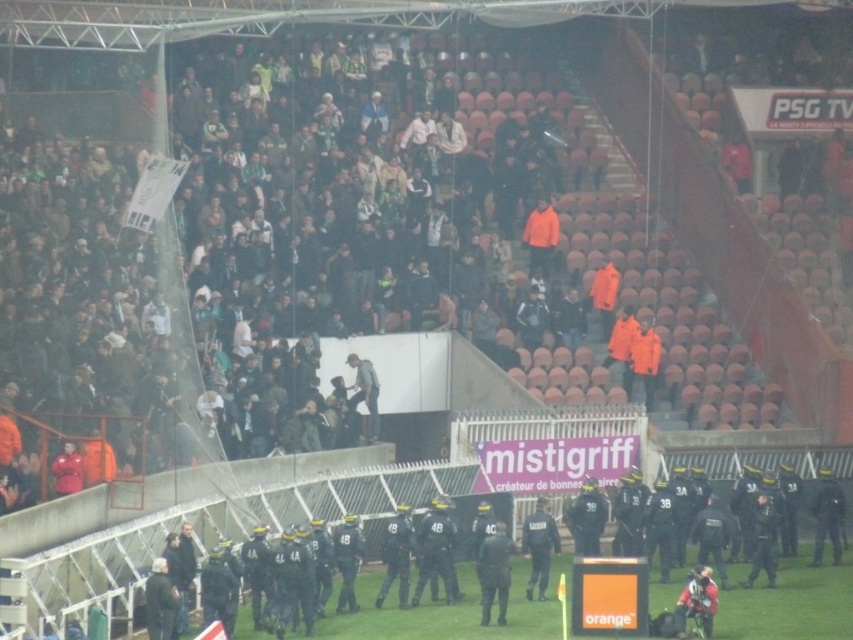
The width and height of the screenshot is (853, 640). What do you see at coordinates (434, 550) in the screenshot?
I see `black matte uniform at center` at bounding box center [434, 550].

Can you confirm if black matte uniform at center is thinner than dark green uniform at center?

No, black matte uniform at center is not thinner than dark green uniform at center.

At what (x,y) coordinates should I click in order to perform the action: click on black matte uniform at center. Please return your answer as a coordinate pair (x, y). Looking at the image, I should click on (434, 550).

At what (x,y) coordinates should I click in order to perform the action: click on black matte uniform at center. Please return your answer as a coordinate pair (x, y). Looking at the image, I should click on (434, 550).

Between point (483, 545) and point (534, 536), which one is positioned behind?

Positioned behind is point (534, 536).

Is dark green uniform at center positioned behind black uniformed officer at center?

No, dark green uniform at center is closer to the viewer.

The image size is (853, 640). Describe the element at coordinates (494, 572) in the screenshot. I see `dark green uniform at center` at that location.

At what (x,y) coordinates should I click in order to perform the action: click on dark green uniform at center. Please return your answer as a coordinate pair (x, y). This screenshot has width=853, height=640. Looking at the image, I should click on (494, 572).

Is point (419, 550) closer to camera compared to point (552, 520)?

Yes, point (419, 550) is closer to viewer.

Find the location of a particular element. black matte uniform at center is located at coordinates (434, 550).

Which is in front, point (453, 540) or point (531, 548)?

Point (453, 540) is in front.

Locate an element on the screen. black matte uniform at center is located at coordinates (434, 550).